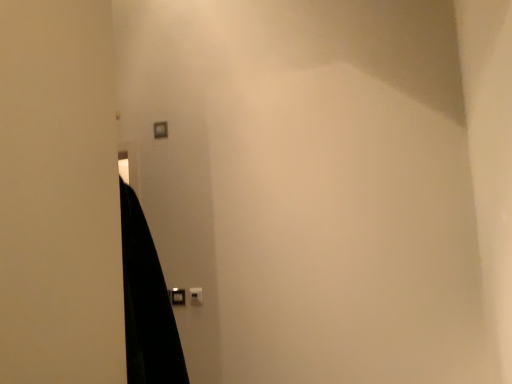
Question: Should I look upward or downward to see matte plastic light switch at upper center, acting as the 2th light switch starting from the right?

Choices:
 (A) down
 (B) up

Answer: (B)

Question: Is black plastic door handle at lower center positioned with its back to white plastic light switch at center, arranged as the second light switch when viewed from the back?

Choices:
 (A) no
 (B) yes

Answer: (A)

Question: Can you confirm if black plastic door handle at lower center is taller than white plastic light switch at center, which appears as the 2th light switch when viewed from the top?

Choices:
 (A) no
 (B) yes

Answer: (A)

Question: From the image's perspective, is black plastic door handle at lower center on white plastic light switch at center, arranged as the second light switch when viewed from the back?

Choices:
 (A) no
 (B) yes

Answer: (A)

Question: From a real-world perspective, is black plastic door handle at lower center below white plastic light switch at center, which appears as the first light switch when ordered from the bottom?

Choices:
 (A) no
 (B) yes

Answer: (A)

Question: Is black plastic door handle at lower center surrounding white plastic light switch at center, which appears as the 2th light switch when viewed from the top?

Choices:
 (A) yes
 (B) no

Answer: (B)

Question: Can you confirm if black plastic door handle at lower center is wider than white plastic light switch at center, arranged as the 1th light switch when viewed from the front?

Choices:
 (A) yes
 (B) no

Answer: (A)

Question: Can you confirm if black plastic door handle at lower center is taller than matte plastic light switch at upper center, acting as the 2th light switch starting from the front?

Choices:
 (A) no
 (B) yes

Answer: (A)

Question: From the image's perspective, would you say black plastic door handle at lower center is shown under matte plastic light switch at upper center, marked as the first light switch in a top-to-bottom arrangement?

Choices:
 (A) yes
 (B) no

Answer: (A)

Question: Is black plastic door handle at lower center wider than matte plastic light switch at upper center, placed as the first light switch when sorted from left to right?

Choices:
 (A) no
 (B) yes

Answer: (B)

Question: Is black plastic door handle at lower center further to camera compared to matte plastic light switch at upper center, placed as the first light switch when sorted from left to right?

Choices:
 (A) yes
 (B) no

Answer: (B)

Question: Does black plastic door handle at lower center have a lesser width compared to matte plastic light switch at upper center, marked as the first light switch in a top-to-bottom arrangement?

Choices:
 (A) yes
 (B) no

Answer: (B)

Question: Is black plastic door handle at lower center not inside matte plastic light switch at upper center, placed as the first light switch when sorted from left to right?

Choices:
 (A) no
 (B) yes

Answer: (B)

Question: Does white plastic light switch at center, arranged as the second light switch when viewed from the back, appear on the right side of matte plastic light switch at upper center, acting as the 2th light switch starting from the front?

Choices:
 (A) no
 (B) yes

Answer: (B)